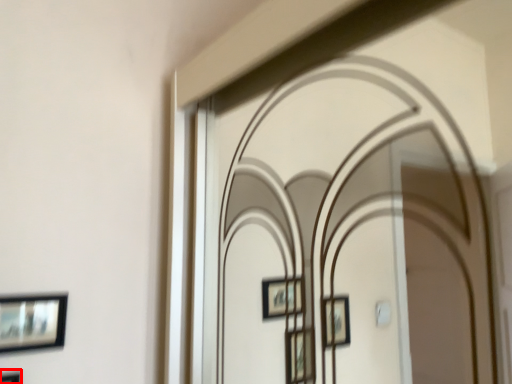
Question: From the image's perspective, considering the relative positions of picture frame (annotated by the red box) and picture frame in the image provided, where is picture frame (annotated by the red box) located with respect to the staircase?

Choices:
 (A) below
 (B) above

Answer: (A)